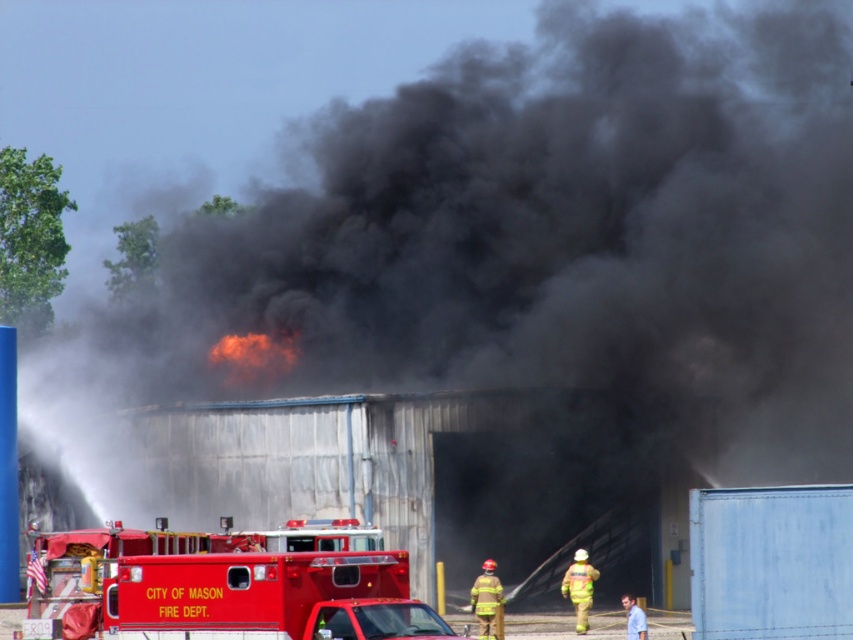
Question: Which object appears closest to the camera in this image?

Choices:
 (A) red reflective helmet at lower center
 (B) reflective yellow fireman at lower right

Answer: (A)

Question: Which of the following is the closest to the observer?

Choices:
 (A) reflective yellow fireman at lower right
 (B) shiny red fire truck at lower left
 (C) red reflective helmet at lower center

Answer: (B)

Question: From the image, what is the correct spatial relationship of shiny red fire truck at lower left in relation to red reflective helmet at lower center?

Choices:
 (A) below
 (B) above

Answer: (B)

Question: Is the position of shiny red fire truck at lower left less distant than that of reflective yellow fireman at lower right?

Choices:
 (A) no
 (B) yes

Answer: (B)

Question: Is shiny red fire truck at lower left further to camera compared to reflective yellow fireman at lower right?

Choices:
 (A) yes
 (B) no

Answer: (B)

Question: Which point is farther to the camera?

Choices:
 (A) shiny red fire truck at lower left
 (B) reflective yellow fireman at lower right

Answer: (B)